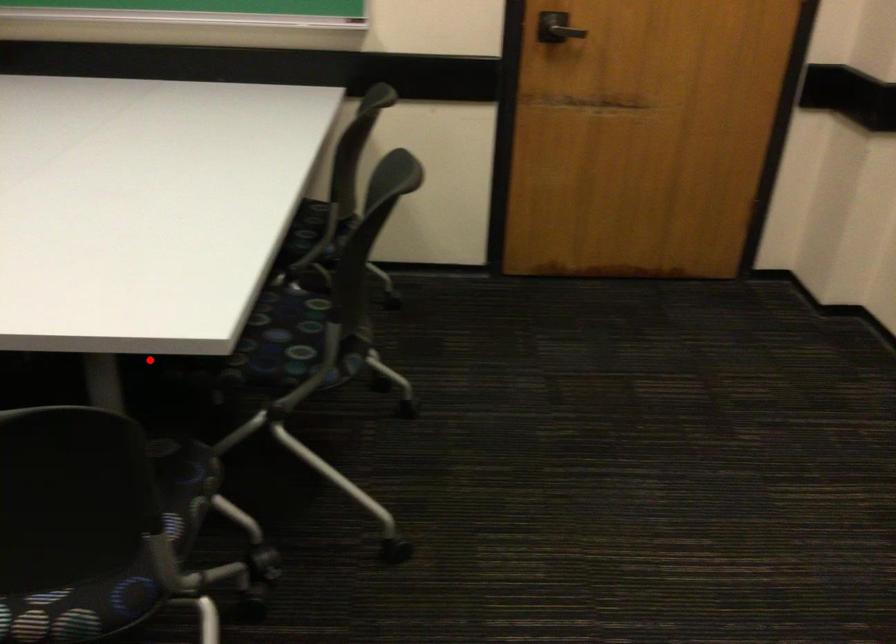
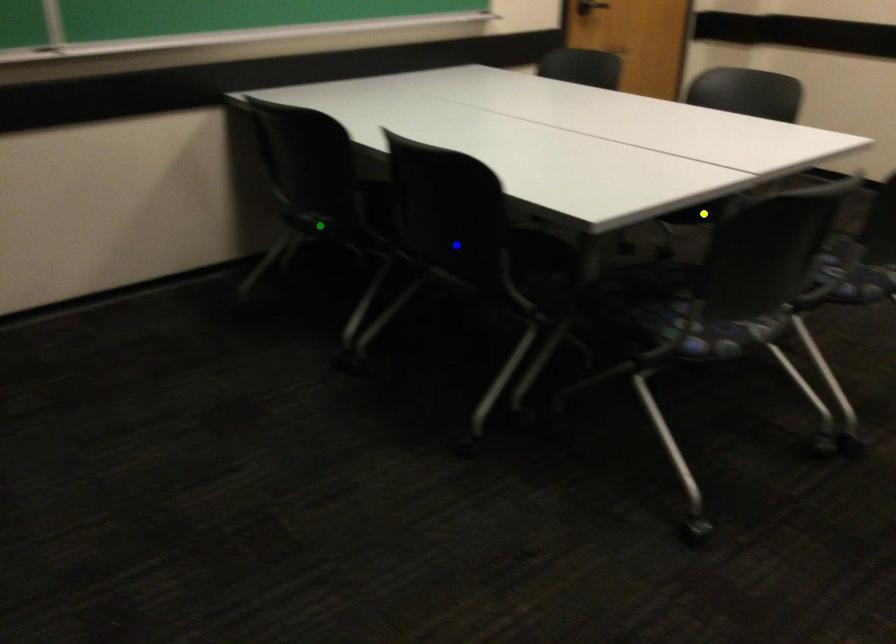
Question: I am providing you with two images of the same scene from different viewpoints. A red point is marked on the first image. You are given multiple points on the second image. Which mark in image 2 goes with the point in image 1?

Choices:
 (A) green point
 (B) yellow point
 (C) blue point

Answer: (B)